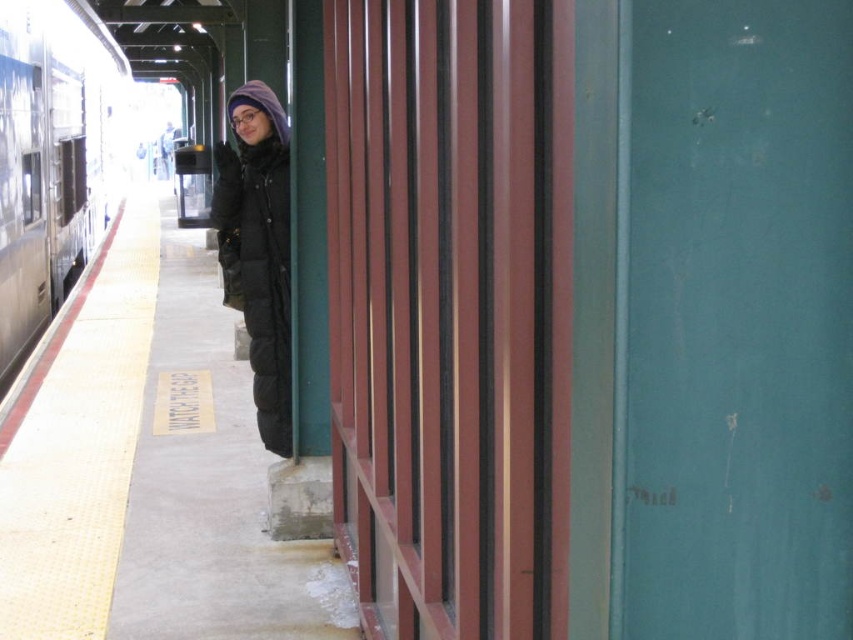
Question: Is the position of silver metallic train at left more distant than that of matte black coat at center?

Choices:
 (A) no
 (B) yes

Answer: (B)

Question: Estimate the real-world distances between objects in this image. Which object is closer to the concrete platform at lower left?

Choices:
 (A) silver metallic train at left
 (B) matte black coat at center

Answer: (B)

Question: Is concrete platform at lower left below silver metallic train at left?

Choices:
 (A) yes
 (B) no

Answer: (A)

Question: Which point is farther from the camera taking this photo?

Choices:
 (A) (242, 128)
 (B) (137, 308)
 (C) (100, 52)

Answer: (C)

Question: Which of the following is the closest to the observer?

Choices:
 (A) silver metallic train at left
 (B) matte black coat at center
 (C) concrete platform at lower left

Answer: (C)

Question: Does concrete platform at lower left have a larger size compared to matte black coat at center?

Choices:
 (A) yes
 (B) no

Answer: (A)